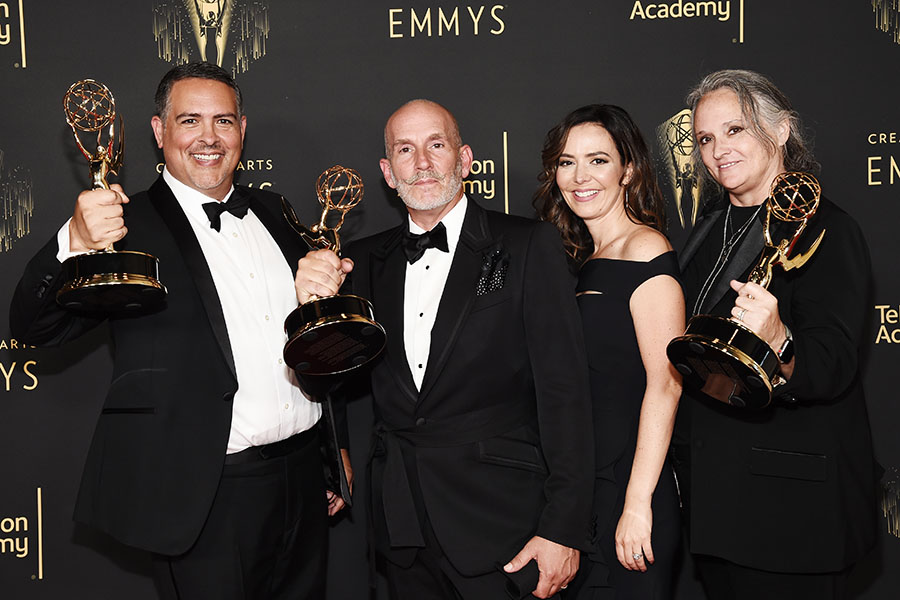
This screenshot has height=600, width=900. In order to click on award in this screenshot , I will do click(x=90, y=130).